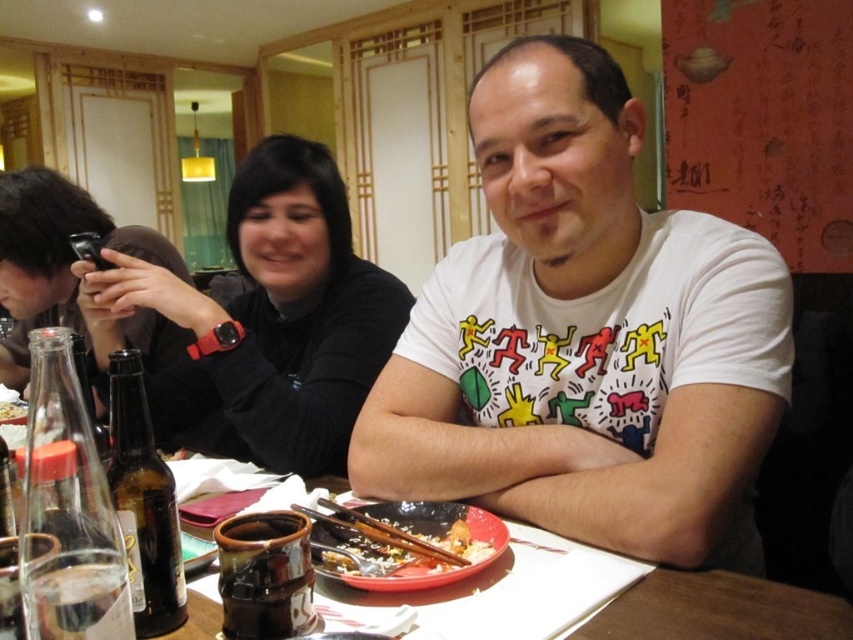
You are a photographer adjusting your camera settings. You notice two points in the scene at coordinates point (589, 122) and point (172, 412). Which point should you focus on to ensure the foreground subject is sharp?

Point (589, 122) is closer to the camera than point (172, 412), so focusing on point (589, 122) will ensure the foreground subject is sharp.

You are a waiter in a restaurant and need to retrieve the brown glass bottle at lower left for a customer. Can you reach it without moving the clear glass bottle at lower left?

The clear glass bottle at lower left is in front of the brown glass bottle at lower left, so you would need to move the clear glass bottle at lower left to access the brown glass bottle at lower left.